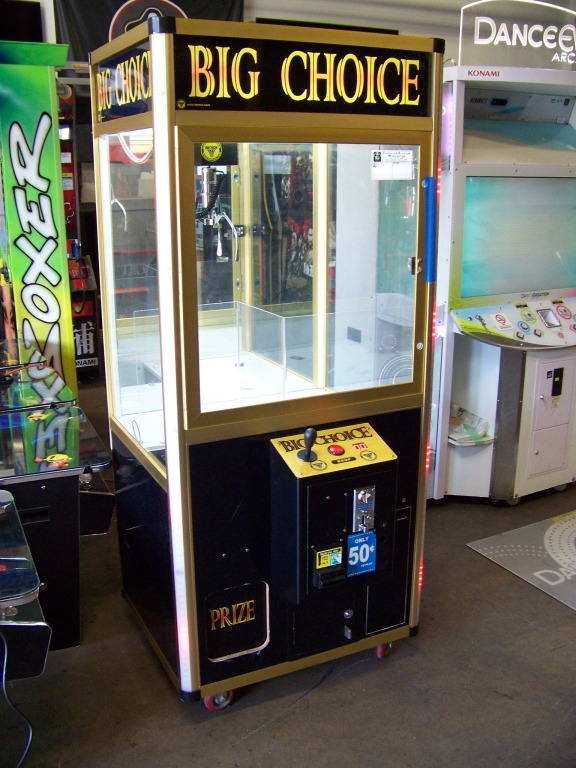
I want to click on ceiling, so click(420, 14).